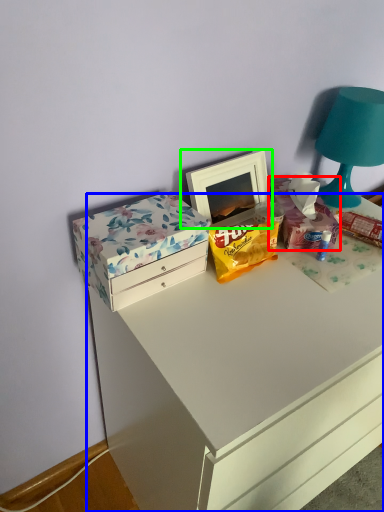
Question: Which object is positioned farthest from storage box (highlighted by a red box)? Select from chest of drawers (highlighted by a blue box) and picture frame (highlighted by a green box).

Choices:
 (A) chest of drawers
 (B) picture frame

Answer: (A)